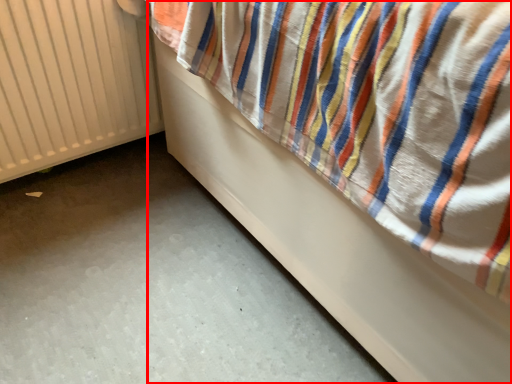
Question: From the image's perspective, where is furniture (annotated by the red box) located relative to radiator?

Choices:
 (A) above
 (B) below

Answer: (A)